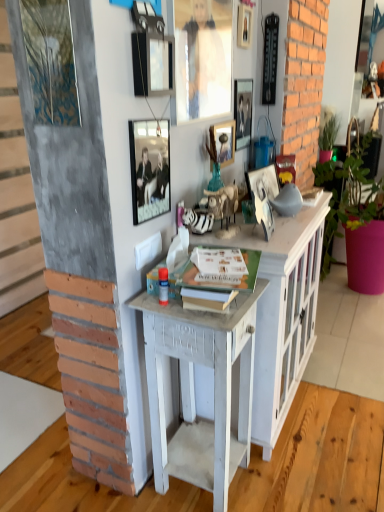
At what (x,y) coordinates should I click in order to perform the action: click on metallic silver picture frame at upper center, placed as the first picture frame when sorted from left to right. Please return your answer as a coordinate pair (x, y). Looking at the image, I should click on point(149,168).

Image resolution: width=384 pixels, height=512 pixels. What do you see at coordinates (178, 278) in the screenshot?
I see `green matte book at center` at bounding box center [178, 278].

This screenshot has width=384, height=512. Identify the location of metallic silver picture frame at center, which is the 7th picture frame from left to right. (263, 196).

Where is `metallic silver picture frame at upper center, the 7th picture frame when ordered from right to left`? metallic silver picture frame at upper center, the 7th picture frame when ordered from right to left is located at coordinates (149, 168).

Is matte glass picture frame at upper center, which ranks as the third picture frame in left-to-right order, oriented towards matte glass picture frame at upper center, which is the fourth picture frame from left to right?

No, matte glass picture frame at upper center, which ranks as the third picture frame in left-to-right order, is not aimed at matte glass picture frame at upper center, which is the fourth picture frame from left to right.

Considering the relative sizes of matte glass picture frame at upper center, acting as the fifth picture frame starting from the right, and matte glass picture frame at upper center, the 4th picture frame when ordered from right to left, in the image provided, is matte glass picture frame at upper center, acting as the fifth picture frame starting from the right, thinner than matte glass picture frame at upper center, the 4th picture frame when ordered from right to left,?

Incorrect, the width of matte glass picture frame at upper center, acting as the fifth picture frame starting from the right, is not less than that of matte glass picture frame at upper center, the 4th picture frame when ordered from right to left.

Visually, is matte glass picture frame at upper center, which ranks as the third picture frame in left-to-right order, positioned to the left or to the right of matte glass picture frame at upper center, the 4th picture frame when ordered from right to left?

In the image, matte glass picture frame at upper center, which ranks as the third picture frame in left-to-right order, appears on the left side of matte glass picture frame at upper center, the 4th picture frame when ordered from right to left.

Can you confirm if white painted wood cabinet at center is positioned to the left of matte glass picture frame at upper center, which ranks as the third picture frame in left-to-right order?

Incorrect, white painted wood cabinet at center is not on the left side of matte glass picture frame at upper center, which ranks as the third picture frame in left-to-right order.

Does point (291, 239) come farther from viewer compared to point (194, 90)?

Yes, it is.

The image size is (384, 512). I want to click on cabinetry below the matte glass picture frame at upper center, which ranks as the third picture frame in left-to-right order (from a real-world perspective), so click(x=282, y=311).

Considering the positions of objects white painted wood desk at center and matte black picture frame at upper center, arranged as the second picture frame when viewed from the left, in the image provided, who is behind, white painted wood desk at center or matte black picture frame at upper center, arranged as the second picture frame when viewed from the left,?

white painted wood desk at center is behind.

From the image's perspective, is white painted wood desk at center positioned above or below matte black picture frame at upper center, arranged as the second picture frame when viewed from the left?

Clearly, from the image's perspective, white painted wood desk at center is below matte black picture frame at upper center, arranged as the second picture frame when viewed from the left.

Looking at this image, does white painted wood desk at center have a greater width compared to matte black picture frame at upper center, arranged as the second picture frame when viewed from the left?

Yes, white painted wood desk at center is wider than matte black picture frame at upper center, arranged as the second picture frame when viewed from the left.

Is white painted wood desk at center placed right next to matte black picture frame at upper center, which ranks as the 6th picture frame in right-to-left order?

No, white painted wood desk at center is not in contact with matte black picture frame at upper center, which ranks as the 6th picture frame in right-to-left order.

Looking at the image, does metallic silver picture frame at center, which is the 7th picture frame from left to right, seem bigger or smaller compared to green matte book at center?

Considering their sizes, metallic silver picture frame at center, which is the 7th picture frame from left to right, takes up less space than green matte book at center.

Based on the photo, from the image's perspective, who appears lower, metallic silver picture frame at center, acting as the 1th picture frame starting from the right, or green matte book at center?

green matte book at center is shown below in the image.

Which point is more forward, (264,209) or (163,260)?

The point (163,260) is closer to the camera.

Is green matte book at center at the back of metallic silver picture frame at center, acting as the 1th picture frame starting from the right?

That's not correct — metallic silver picture frame at center, acting as the 1th picture frame starting from the right, is not looking away from green matte book at center.

Does point (271, 221) lie in front of point (133, 186)?

No.

Who is bigger, metallic silver picture frame at center, acting as the 1th picture frame starting from the right, or metallic silver picture frame at upper center, placed as the first picture frame when sorted from left to right?

metallic silver picture frame at center, acting as the 1th picture frame starting from the right, is bigger.

Is metallic silver picture frame at center, acting as the 1th picture frame starting from the right, not close to metallic silver picture frame at upper center, placed as the first picture frame when sorted from left to right?

They are positioned close to each other.

From the image's perspective, is metallic silver picture frame at center, acting as the 1th picture frame starting from the right, under metallic silver picture frame at upper center, the 7th picture frame when ordered from right to left?

Yes, from the image's perspective, metallic silver picture frame at center, acting as the 1th picture frame starting from the right, is below metallic silver picture frame at upper center, the 7th picture frame when ordered from right to left.

From a real-world perspective, is wooden picture frame at upper center, which ranks as the third picture frame in right-to-left order, on top of white painted wood cabinet at center?

Indeed, from a real-world perspective, wooden picture frame at upper center, which ranks as the third picture frame in right-to-left order, stands above white painted wood cabinet at center.

Is wooden picture frame at upper center, which ranks as the third picture frame in right-to-left order, not inside white painted wood cabinet at center?

Indeed, wooden picture frame at upper center, which ranks as the third picture frame in right-to-left order, is completely outside white painted wood cabinet at center.

Is point (243, 13) closer to camera compared to point (301, 285)?

Yes.

Consider the image. Between wooden picture frame at upper center, which ranks as the third picture frame in right-to-left order, and white painted wood cabinet at center, which one has smaller width?

Thinner between the two is wooden picture frame at upper center, which ranks as the third picture frame in right-to-left order.

At what (x,y) coordinates should I click in order to perform the action: click on desk that is below the pink matte pot at right (from the image's perspective). Please return your answer as a coordinate pair (x, y). Looking at the image, I should click on (194, 390).

Is white painted wood desk at center far away from pink matte pot at right?

Yes, white painted wood desk at center and pink matte pot at right are located far from each other.

Does white painted wood desk at center come in front of pink matte pot at right?

Yes, white painted wood desk at center is in front of pink matte pot at right.

In the scene shown: Does white painted wood desk at center appear on the right side of pink matte pot at right?

No.

At what (x,y) coordinates should I click in order to perform the action: click on the 3rd picture frame positioned above the matte glass picture frame at upper center, the 4th picture frame when ordered from right to left (from a real-world perspective). Please return your answer as a coordinate pair (x, y). This screenshot has height=512, width=384. Looking at the image, I should click on (203, 58).

Locate an element on the screen. This screenshot has width=384, height=512. the 2nd picture frame in front of the white painted wood cabinet at center, starting your count from the anchor is located at coordinates tap(203, 58).

Considering their positions, is metallic silver picture frame at upper center, marked as the second picture frame in a right-to-left arrangement, positioned further to matte glass picture frame at upper center, which is the fourth picture frame from left to right, than wooden picture frame at upper center, which ranks as the third picture frame in right-to-left order?

Based on the image, wooden picture frame at upper center, which ranks as the third picture frame in right-to-left order, appears to be further to matte glass picture frame at upper center, which is the fourth picture frame from left to right.

Considering their positions, is metallic silver picture frame at upper center, which is counted as the 6th picture frame, starting from the left, positioned closer to white painted wood cabinet at center than white painted wood desk at center?

white painted wood desk at center is closer to white painted wood cabinet at center.

When comparing their distances from white painted wood cabinet at center, does green matte book at center or matte glass picture frame at upper center, acting as the fifth picture frame starting from the right, seem further?

matte glass picture frame at upper center, acting as the fifth picture frame starting from the right, lies further to white painted wood cabinet at center than the other object.

From the image, which object appears to be farther from matte glass picture frame at upper center, which ranks as the third picture frame in left-to-right order, metallic silver picture frame at upper center, which is counted as the 6th picture frame, starting from the left, or matte glass picture frame at upper center, which is the fourth picture frame from left to right?

The object further to matte glass picture frame at upper center, which ranks as the third picture frame in left-to-right order, is metallic silver picture frame at upper center, which is counted as the 6th picture frame, starting from the left.

Estimate the real-world distances between objects in this image. Which object is closer to wooden picture frame at upper center, which ranks as the third picture frame in right-to-left order, matte glass picture frame at upper center, which ranks as the third picture frame in left-to-right order, or metallic silver picture frame at upper center, which is counted as the 6th picture frame, starting from the left?

metallic silver picture frame at upper center, which is counted as the 6th picture frame, starting from the left, is positioned closer to the anchor wooden picture frame at upper center, which ranks as the third picture frame in right-to-left order.

Looking at the image, which one is located closer to metallic silver picture frame at upper center, which is counted as the 6th picture frame, starting from the left, white painted wood desk at center or pink matte pot at right?

Based on the image, white painted wood desk at center appears to be nearer to metallic silver picture frame at upper center, which is counted as the 6th picture frame, starting from the left.

When comparing their distances from matte black picture frame at upper center, which ranks as the 6th picture frame in right-to-left order, does green matte book at center or wooden picture frame at upper center, which ranks as the third picture frame in right-to-left order, seem closer?

green matte book at center is closer to matte black picture frame at upper center, which ranks as the 6th picture frame in right-to-left order.

From the picture: From the image, which object appears to be farther from metallic silver picture frame at upper center, marked as the second picture frame in a right-to-left arrangement, metallic silver picture frame at center, which is the 7th picture frame from left to right, or matte glass picture frame at upper center, acting as the fifth picture frame starting from the right?

Based on the image, metallic silver picture frame at center, which is the 7th picture frame from left to right, appears to be further to metallic silver picture frame at upper center, marked as the second picture frame in a right-to-left arrangement.

Find the location of `cabinetry between green matte book at center and white painted wood desk at center in the up-down direction`. cabinetry between green matte book at center and white painted wood desk at center in the up-down direction is located at coordinates (282, 311).

I want to click on book between matte black picture frame at upper center, which ranks as the 6th picture frame in right-to-left order, and white painted wood cabinet at center vertically, so click(x=178, y=278).

I want to click on cabinetry between metallic silver picture frame at upper center, which is counted as the 6th picture frame, starting from the left, and white painted wood desk at center, in the vertical direction, so click(282, 311).

This screenshot has width=384, height=512. I want to click on cabinetry between metallic silver picture frame at upper center, placed as the first picture frame when sorted from left to right, and pink matte pot at right, in the horizontal direction, so point(282,311).